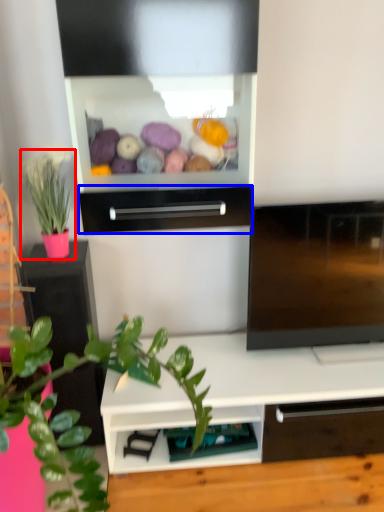
Question: Which object appears closest to the camera in this image, houseplant (highlighted by a red box) or drawer (highlighted by a blue box)?

Choices:
 (A) houseplant
 (B) drawer

Answer: (B)